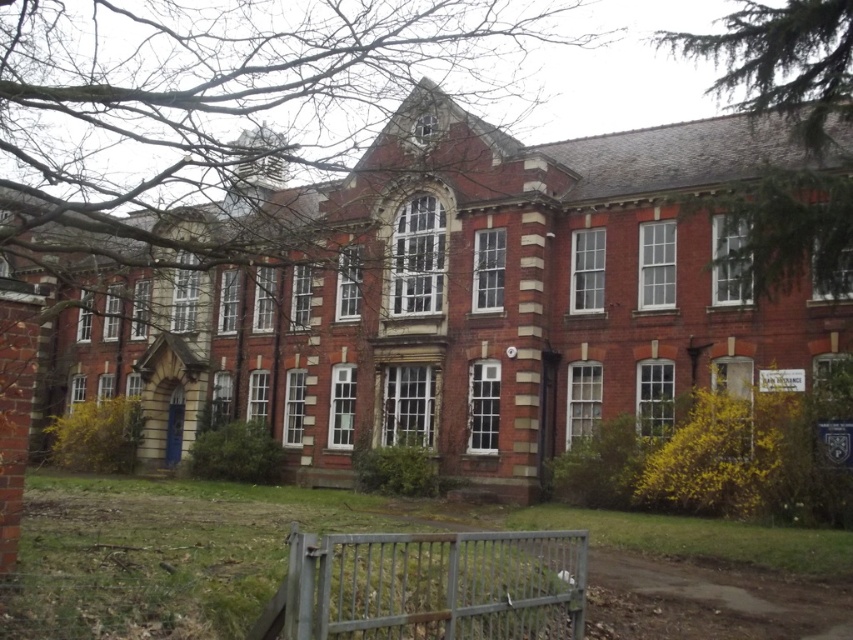
You are standing in front of the building and want to locate two specific points marked on the image. The first point is at coordinate point(537, 573) and the second is at point(793, 208). Which of these two points is closer to you?

Point(537, 573) is closer to the viewer than point(793, 208).

You are standing in front of the red brick building and want to walk from the bare branches at upper center to the green textured tree at upper right. How far will you have to walk?

The distance between the bare branches at upper center and the green textured tree at upper right is 36.81 meters, so you will have to walk 36.81 meters.